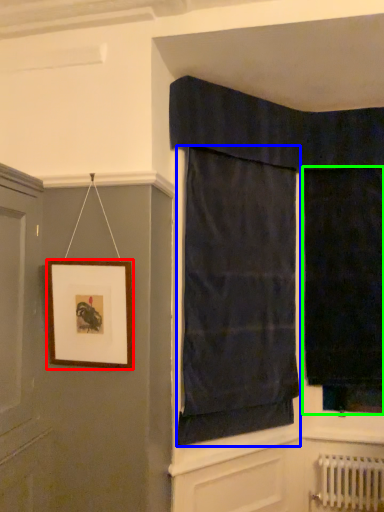
Question: Which is farther away from picture frame (highlighted by a red box)? curtain (highlighted by a blue box) or curtain (highlighted by a green box)?

Choices:
 (A) curtain
 (B) curtain

Answer: (B)